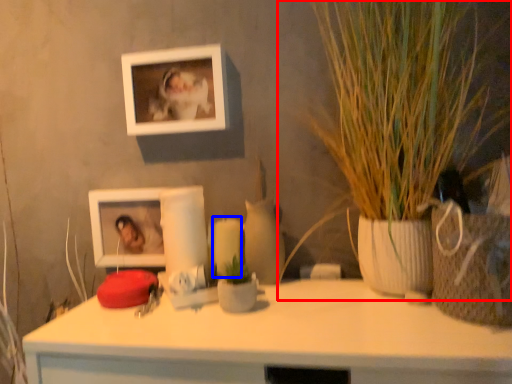
Question: Which point is further to the camera, houseplant (highlighted by a red box) or candle (highlighted by a blue box)?

Choices:
 (A) houseplant
 (B) candle

Answer: (B)